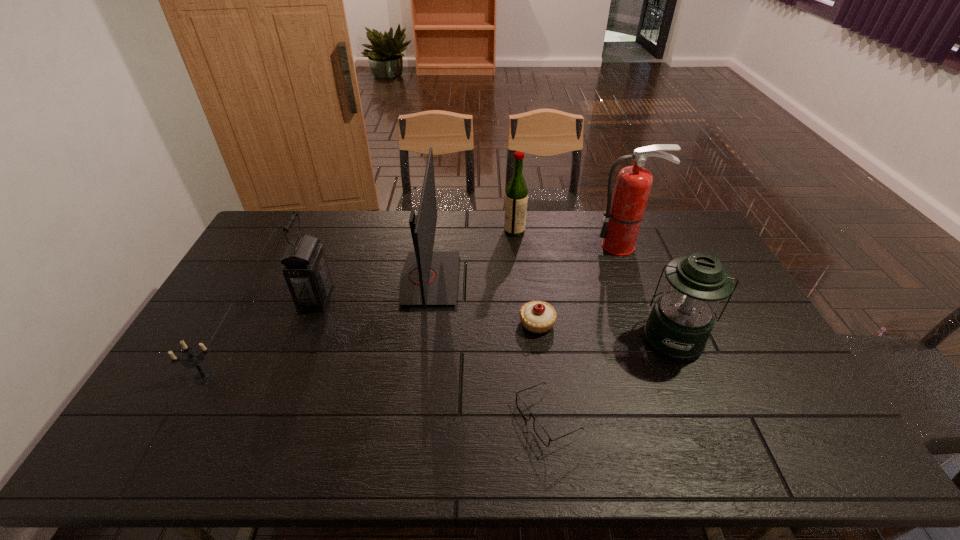
Where is `the shortest object`? Image resolution: width=960 pixels, height=540 pixels. the shortest object is located at coordinates (542, 434).

At what (x,y) coordinates should I click in order to perform the action: click on vacant region located 0.310m with the handle and hose on the fire extinguisher. Please return your answer as a coordinate pair (x, y). This screenshot has height=540, width=960. Looking at the image, I should click on (652, 321).

Identify the location of free spot located 0.350m on the screen side of the monitor. (563, 279).

This screenshot has width=960, height=540. I want to click on free location located on the label of the liquor, so click(x=441, y=231).

Identify the location of free space located 0.320m on the label of the liquor. (420, 231).

Identify the location of vacant space situated 0.060m on the label of the liquor. Image resolution: width=960 pixels, height=540 pixels. (488, 231).

At what (x,y) coordinates should I click in order to perform the action: click on vacant space positioned on the front-facing side of the second object from left to right. Please return your answer as a coordinate pair (x, y). The width and height of the screenshot is (960, 540). Looking at the image, I should click on (395, 298).

You are a GUI agent. You are given a task and a screenshot of the screen. Output one action in this format:
    pyautogui.click(x=<x>, y=<y>)
    Task: Click on the vacant space located on the right of the right lantern
    
    Given the screenshot: What is the action you would take?
    pyautogui.click(x=751, y=338)

Locate an element on the screen. This screenshot has height=540, width=960. free space located on the right of the leftmost object is located at coordinates (314, 377).

In order to click on vacant position located on the right of the second shortest object in this screenshot , I will do `click(678, 323)`.